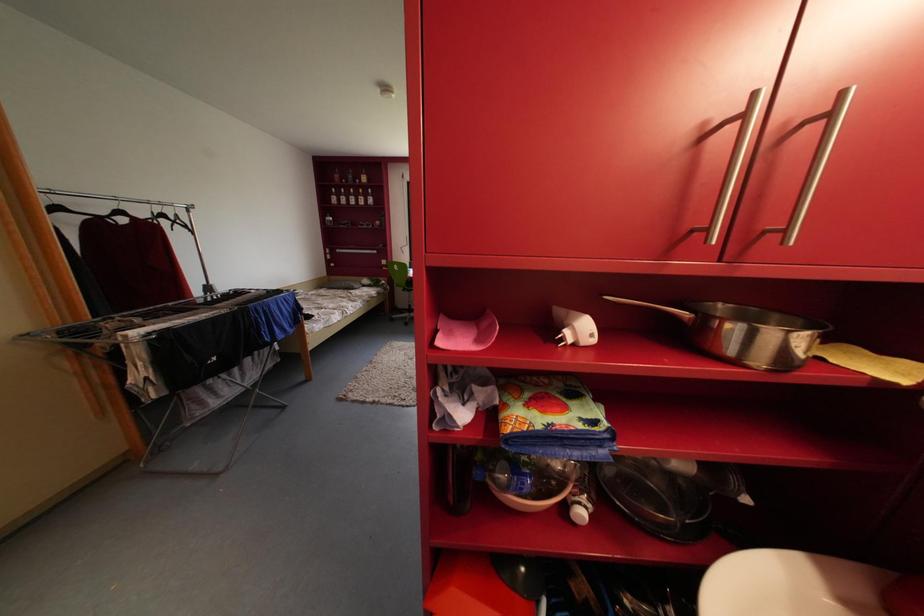
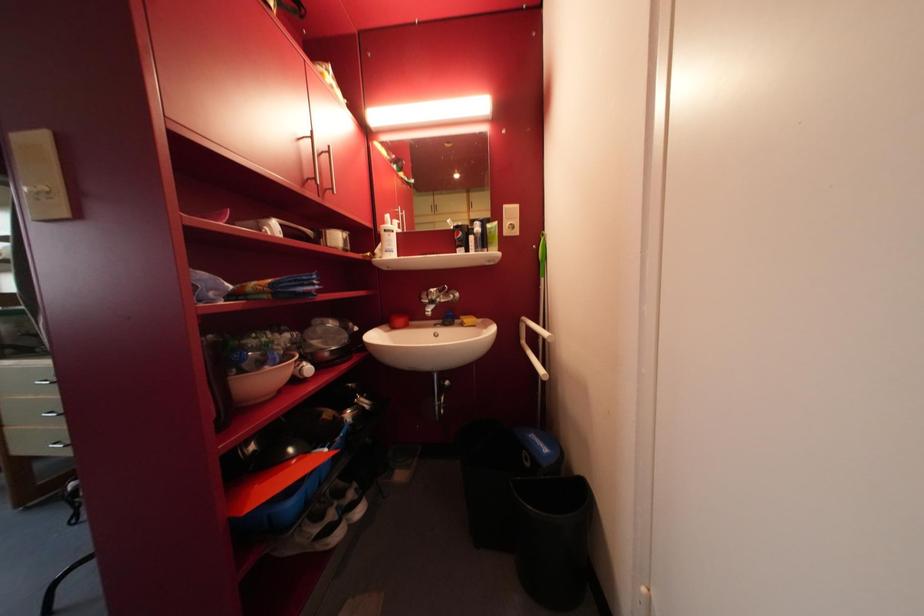
Question: The camera is either moving clockwise (left) or counter-clockwise (right) around the object. The first image is from the beginning of the video and the second image is from the end. Is the camera moving left or right when shooting the video?

Choices:
 (A) Left
 (B) Right

Answer: (A)